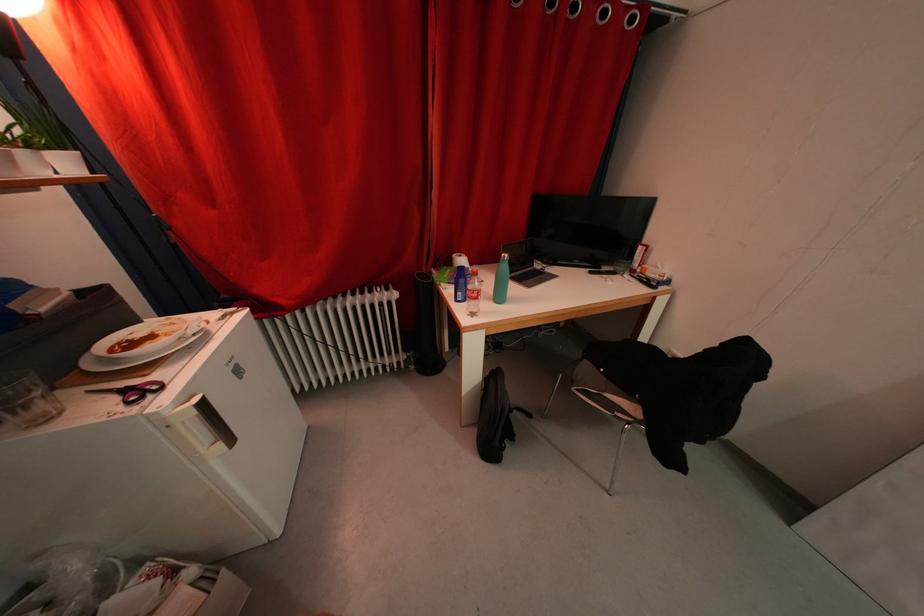
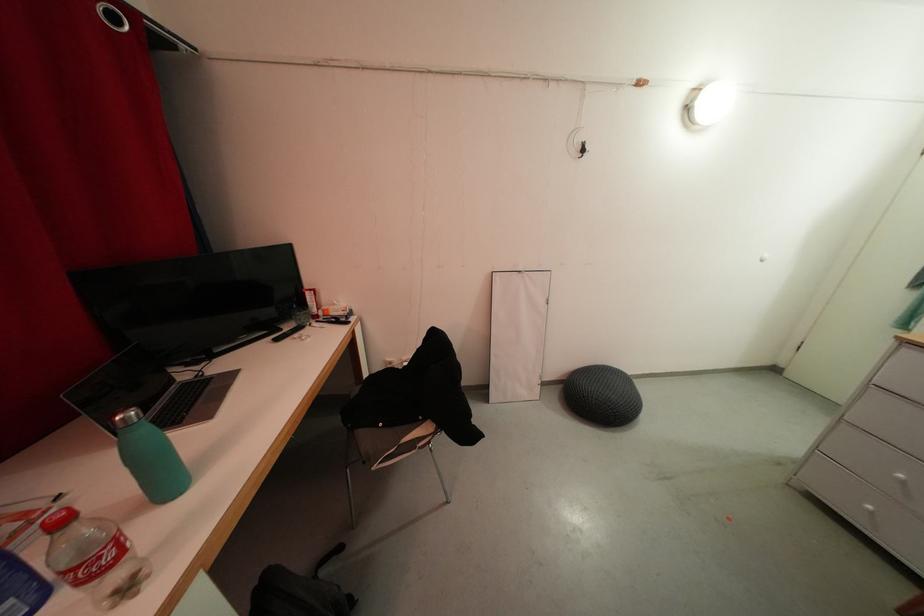
Where in the second image is the point corresponding to (505,301) from the first image?

(173, 487)